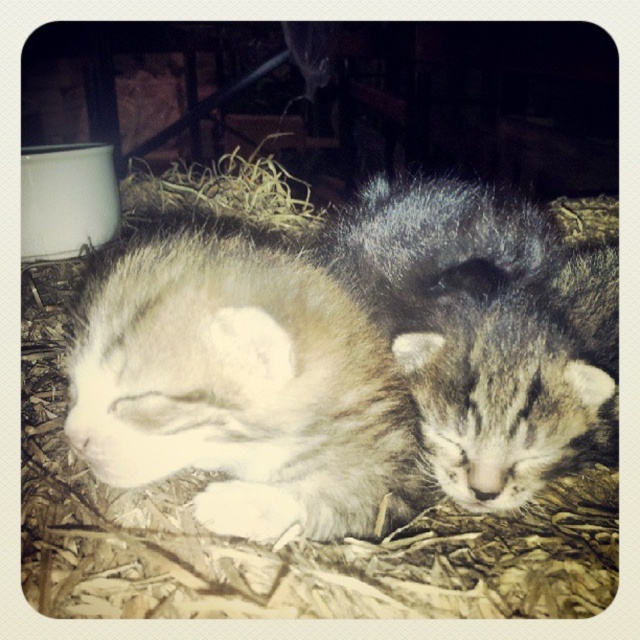
You are a photographer trying to capture a closeup shot of the brown straw at upper center. You are currently positioned 5 feet away from it. There is a white fluffy cat at center between you and the straw. Can you take the photo without moving the cat?

The distance between the white fluffy cat at center and the brown straw at upper center is 4.40 feet. Since you are 5 feet away from the straw, the cat is blocking your path. To take the photo without moving the cat, you would need to move back further so that the total distance from you to the straw is greater than 4.40 feet plus the cat length. However, since you are already 5 feet away, and the cat is only 4.40 feet away from the straw, you are already behind the cat. Wait, maybe there is confusion here.

You are a photographer trying to capture a portrait of both the white fluffy cat at center and the fuzzy brown cat at center. Since you want to ensure both are in focus, you need to know which cat is taller. Which cat is shorter?

The white fluffy cat at center is shorter than the fuzzy brown cat at center, so you should adjust your camera settings to account for their differing heights to ensure both are in focus.

You are a photographer trying to capture a closeup of the white fluffy cat at center without disturbing the fuzzy brown cat at center. Based on their positions, which cat should you focus on first to ensure both are in the frame?

The white fluffy cat at center is positioned under the fuzzy brown cat at center, so you should focus on the fuzzy brown cat at center first to ensure both are in the frame.